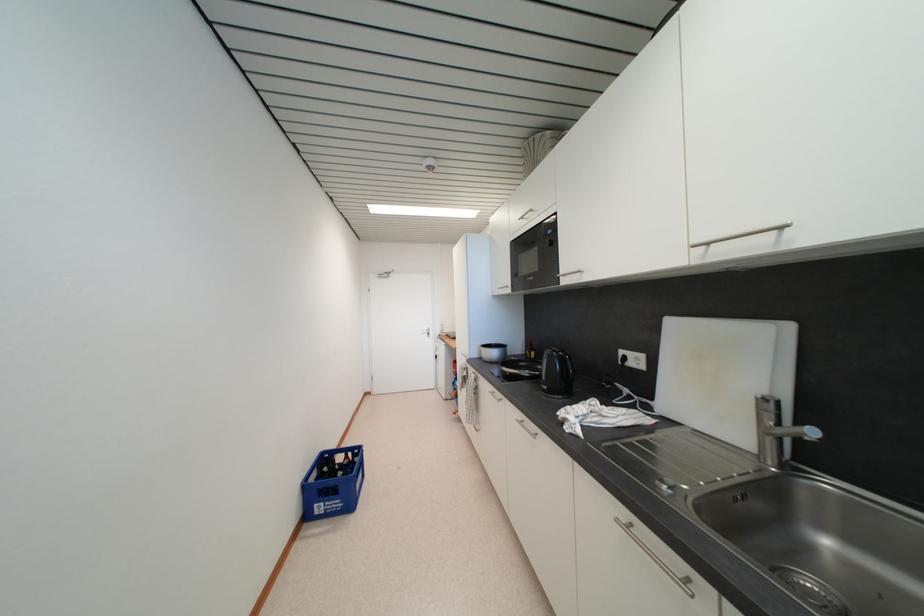
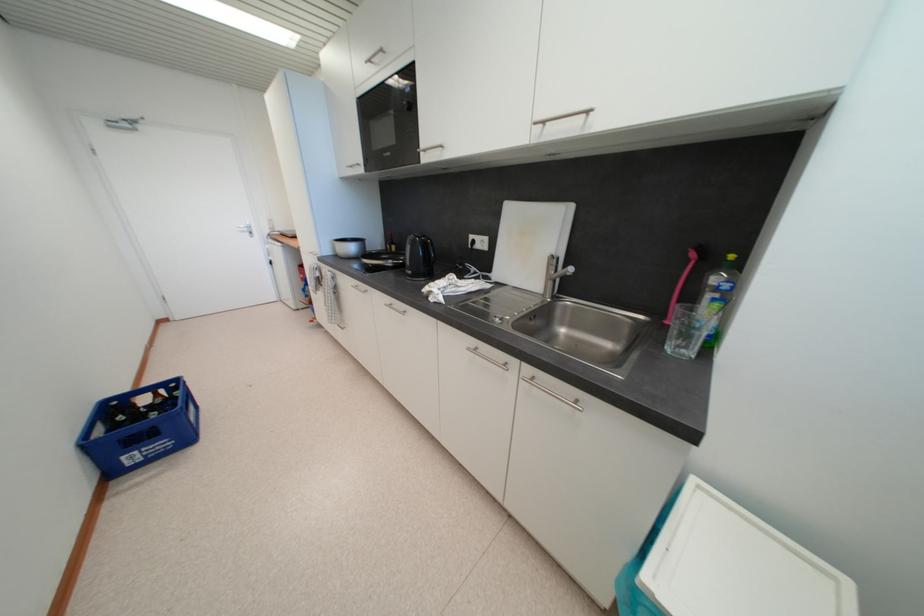
In the second image, find the point that corresponds to (x=784, y=427) in the first image.

(561, 275)